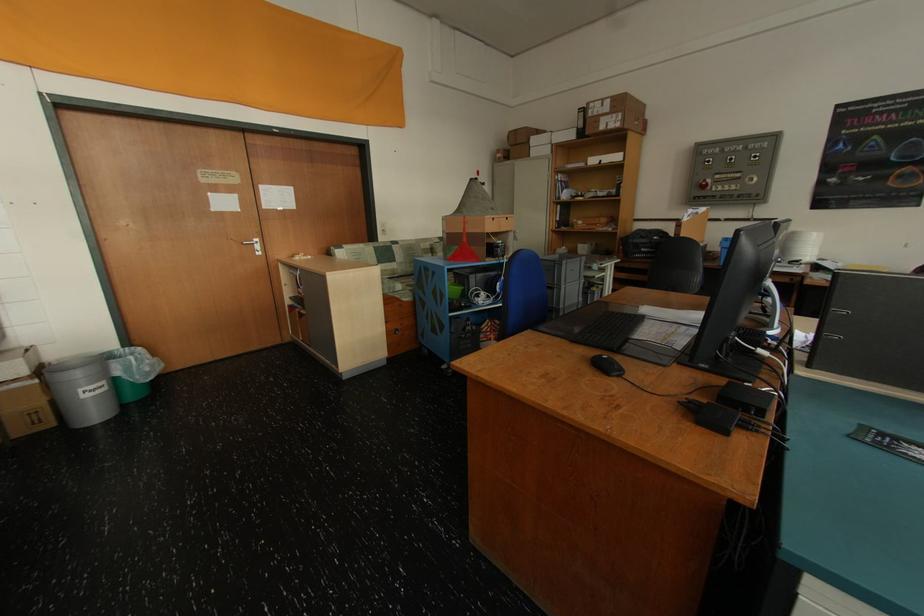
I want to click on silver door handle, so click(x=253, y=245).